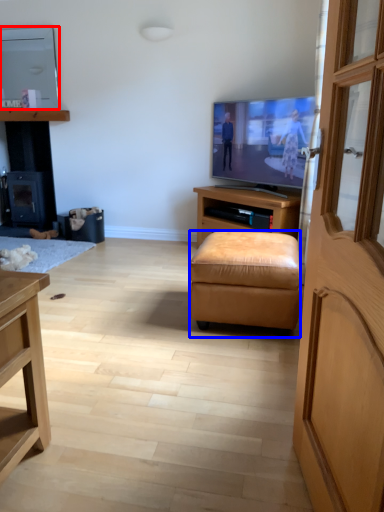
Question: Which object appears farthest to the camera in this image, television (highlighted by a red box) or stool (highlighted by a blue box)?

Choices:
 (A) television
 (B) stool

Answer: (A)